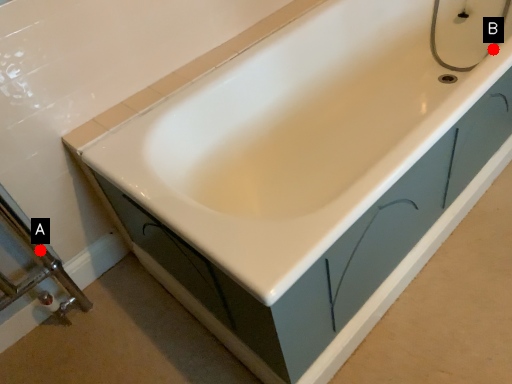
Question: Two points are circled on the image, labeled by A and B beside each circle. Which point is closer to the camera?

Choices:
 (A) A is closer
 (B) B is closer

Answer: (B)